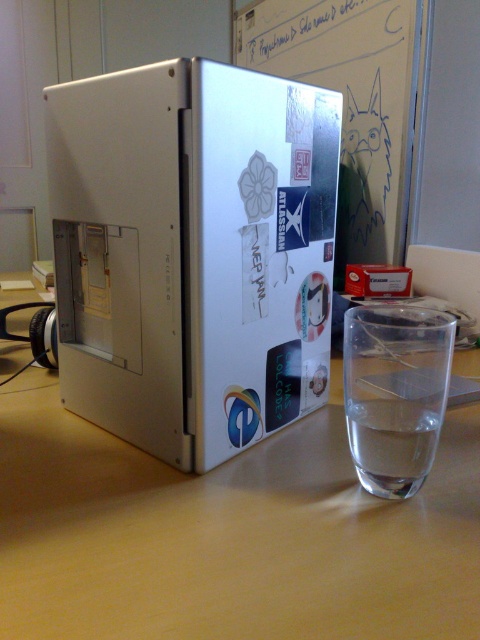
Question: Which object appears farthest from the camera in this image?

Choices:
 (A) satin silver laptop at center
 (B) transparent glass at right

Answer: (A)

Question: Is matte plastic computer case at center above transparent glass at right?

Choices:
 (A) no
 (B) yes

Answer: (A)

Question: Considering the relative positions of matte plastic computer case at center and transparent glass at right in the image provided, where is matte plastic computer case at center located with respect to transparent glass at right?

Choices:
 (A) below
 (B) above

Answer: (A)

Question: Which point is closer to the camera?

Choices:
 (A) pyautogui.click(x=394, y=387)
 (B) pyautogui.click(x=213, y=298)
 (C) pyautogui.click(x=460, y=368)

Answer: (A)

Question: Which object is closer to the camera taking this photo?

Choices:
 (A) matte plastic computer case at center
 (B) satin silver laptop at center
 (C) transparent glass at right

Answer: (A)

Question: From the image, what is the correct spatial relationship of matte plastic computer case at center in relation to transparent glass at right?

Choices:
 (A) above
 (B) below

Answer: (B)